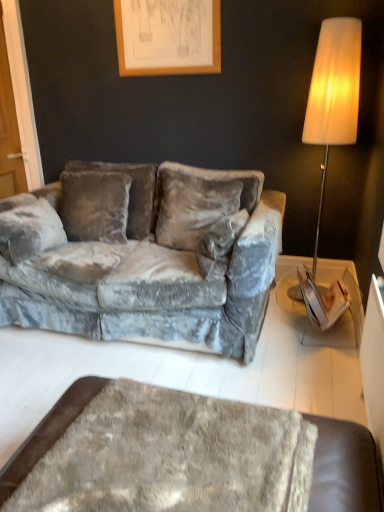
Question: From the image's perspective, would you say wooden picture frame at upper center is shown under fuzzy brown ottoman at lower center?

Choices:
 (A) yes
 (B) no

Answer: (B)

Question: Does wooden picture frame at upper center have a greater width compared to fuzzy brown ottoman at lower center?

Choices:
 (A) yes
 (B) no

Answer: (B)

Question: Is wooden picture frame at upper center at the left side of fuzzy brown ottoman at lower center?

Choices:
 (A) yes
 (B) no

Answer: (A)

Question: Can you confirm if wooden picture frame at upper center is bigger than fuzzy brown ottoman at lower center?

Choices:
 (A) no
 (B) yes

Answer: (A)

Question: Can you confirm if wooden picture frame at upper center is taller than fuzzy brown ottoman at lower center?

Choices:
 (A) no
 (B) yes

Answer: (B)

Question: From their relative heights in the image, would you say velvet gray couch at center is taller or shorter than fuzzy brown ottoman at lower center?

Choices:
 (A) short
 (B) tall

Answer: (B)

Question: Is velvet gray couch at center to the left or to the right of fuzzy brown ottoman at lower center in the image?

Choices:
 (A) right
 (B) left

Answer: (B)

Question: Considering the positions of velvet gray couch at center and fuzzy brown ottoman at lower center in the image, is velvet gray couch at center wider or thinner than fuzzy brown ottoman at lower center?

Choices:
 (A) wide
 (B) thin

Answer: (A)

Question: In the image, is velvet gray couch at center positioned in front of or behind fuzzy brown ottoman at lower center?

Choices:
 (A) behind
 (B) front

Answer: (A)

Question: From their relative heights in the image, would you say fuzzy brown ottoman at lower center is taller or shorter than velvet gray couch at center?

Choices:
 (A) tall
 (B) short

Answer: (B)

Question: Looking at the image, does fuzzy brown ottoman at lower center seem bigger or smaller compared to velvet gray couch at center?

Choices:
 (A) big
 (B) small

Answer: (B)

Question: Considering the positions of fuzzy brown ottoman at lower center and velvet gray couch at center in the image, is fuzzy brown ottoman at lower center wider or thinner than velvet gray couch at center?

Choices:
 (A) thin
 (B) wide

Answer: (A)

Question: Considering the positions of point (332, 451) and point (157, 337), is point (332, 451) closer or farther from the camera than point (157, 337)?

Choices:
 (A) closer
 (B) farther

Answer: (A)

Question: Looking at the image, does velvet gray couch at center seem bigger or smaller compared to wooden picture frame at upper center?

Choices:
 (A) small
 (B) big

Answer: (B)

Question: Considering the positions of velvet gray couch at center and wooden picture frame at upper center in the image, is velvet gray couch at center wider or thinner than wooden picture frame at upper center?

Choices:
 (A) thin
 (B) wide

Answer: (B)